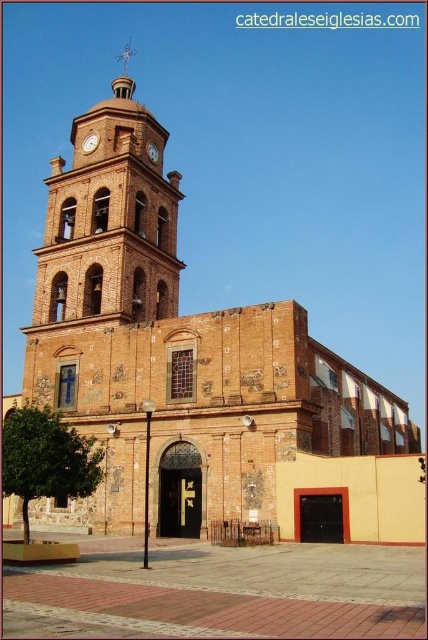
Question: Which point is closer to the camera?

Choices:
 (A) matte brown clock at upper center
 (B) brown brick bell tower at center

Answer: (B)

Question: Does brown brick bell tower at center have a larger size compared to wooden clock at center?

Choices:
 (A) no
 (B) yes

Answer: (B)

Question: Which point is farther to the camera?

Choices:
 (A) (142, 168)
 (B) (146, 150)

Answer: (B)

Question: Is brown brick bell tower at center to the left of wooden clock at center from the viewer's perspective?

Choices:
 (A) no
 (B) yes

Answer: (B)

Question: Estimate the real-world distances between objects in this image. Which object is closer to the matte brown clock at upper center?

Choices:
 (A) brown brick bell tower at center
 (B) wooden clock at center

Answer: (B)

Question: Is brown brick bell tower at center wider than matte brown clock at upper center?

Choices:
 (A) yes
 (B) no

Answer: (A)